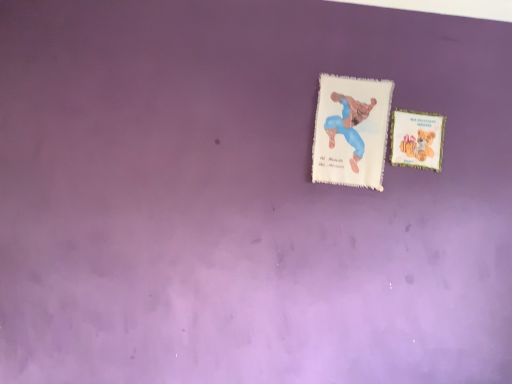
Describe the element at coordinates (351, 131) in the screenshot. I see `white felt card at upper center, placed as the 2th card when sorted from right to left` at that location.

The width and height of the screenshot is (512, 384). Identify the location of white felt card at upper center, arranged as the first card when viewed from the left. (351, 131).

Identify the location of matte paper card at right, which is counted as the 1th card, starting from the right. This screenshot has height=384, width=512. (417, 139).

In order to face matte paper card at right, marked as the 2th card in a left-to-right arrangement, should I rotate leftwards or rightwards?

To face it directly, rotate right by 21.128 degrees.

This screenshot has height=384, width=512. Describe the element at coordinates (417, 139) in the screenshot. I see `matte paper card at right, which is counted as the 1th card, starting from the right` at that location.

Locate an element on the screen. Image resolution: width=512 pixels, height=384 pixels. white felt card at upper center, arranged as the first card when viewed from the left is located at coordinates [351, 131].

In the image, is matte paper card at right, which is counted as the 1th card, starting from the right, on the left side or the right side of white felt card at upper center, arranged as the first card when viewed from the left?

Clearly, matte paper card at right, which is counted as the 1th card, starting from the right, is on the right of white felt card at upper center, arranged as the first card when viewed from the left, in the image.

Is matte paper card at right, which is counted as the 1th card, starting from the right, closer to the viewer compared to white felt card at upper center, arranged as the first card when viewed from the left?

No, the depth of matte paper card at right, which is counted as the 1th card, starting from the right, is greater than that of white felt card at upper center, arranged as the first card when viewed from the left.

Considering the positions of point (405, 142) and point (371, 112), is point (405, 142) closer or farther from the camera than point (371, 112)?

Point (405, 142).

From the image's perspective, is matte paper card at right, marked as the 2th card in a left-to-right arrangement, over white felt card at upper center, arranged as the first card when viewed from the left?

Incorrect, from the image's perspective, matte paper card at right, marked as the 2th card in a left-to-right arrangement, is lower than white felt card at upper center, arranged as the first card when viewed from the left.

From a real-world perspective, is matte paper card at right, which is counted as the 1th card, starting from the right, above or below white felt card at upper center, placed as the 2th card when sorted from right to left?

From a real-world perspective, matte paper card at right, which is counted as the 1th card, starting from the right, is physically above white felt card at upper center, placed as the 2th card when sorted from right to left.

Does matte paper card at right, marked as the 2th card in a left-to-right arrangement, have a greater width compared to white felt card at upper center, placed as the 2th card when sorted from right to left?

No, matte paper card at right, marked as the 2th card in a left-to-right arrangement, is not wider than white felt card at upper center, placed as the 2th card when sorted from right to left.

Which of these two, matte paper card at right, marked as the 2th card in a left-to-right arrangement, or white felt card at upper center, placed as the 2th card when sorted from right to left, stands shorter?

Standing shorter between the two is matte paper card at right, marked as the 2th card in a left-to-right arrangement.

Is matte paper card at right, marked as the 2th card in a left-to-right arrangement, bigger than white felt card at upper center, arranged as the first card when viewed from the left?

No.

Is matte paper card at right, which is counted as the 1th card, starting from the right, spatially inside white felt card at upper center, placed as the 2th card when sorted from right to left, or outside of it?

matte paper card at right, which is counted as the 1th card, starting from the right, is located beyond the bounds of white felt card at upper center, placed as the 2th card when sorted from right to left.

Are matte paper card at right, marked as the 2th card in a left-to-right arrangement, and white felt card at upper center, placed as the 2th card when sorted from right to left, making contact?

No, matte paper card at right, marked as the 2th card in a left-to-right arrangement, is not beside white felt card at upper center, placed as the 2th card when sorted from right to left.

Is matte paper card at right, which is counted as the 1th card, starting from the right, facing away from white felt card at upper center, placed as the 2th card when sorted from right to left?

No, white felt card at upper center, placed as the 2th card when sorted from right to left, is not at the back of matte paper card at right, which is counted as the 1th card, starting from the right.

Measure the distance between matte paper card at right, which is counted as the 1th card, starting from the right, and white felt card at upper center, arranged as the first card when viewed from the left.

matte paper card at right, which is counted as the 1th card, starting from the right, and white felt card at upper center, arranged as the first card when viewed from the left, are 7.91 inches apart.

Locate an element on the screen. The height and width of the screenshot is (384, 512). card located above the matte paper card at right, marked as the 2th card in a left-to-right arrangement (from the image's perspective) is located at coordinates (351, 131).

Visually, is white felt card at upper center, placed as the 2th card when sorted from right to left, positioned to the left or to the right of matte paper card at right, which is counted as the 1th card, starting from the right?

white felt card at upper center, placed as the 2th card when sorted from right to left, is to the left of matte paper card at right, which is counted as the 1th card, starting from the right.

Which object is more forward, white felt card at upper center, placed as the 2th card when sorted from right to left, or matte paper card at right, marked as the 2th card in a left-to-right arrangement?

white felt card at upper center, placed as the 2th card when sorted from right to left, is closer to the camera.

Is point (360, 112) farther from camera compared to point (409, 164)?

Yes, point (360, 112) is behind point (409, 164).

From the image's perspective, between white felt card at upper center, arranged as the first card when viewed from the left, and matte paper card at right, which is counted as the 1th card, starting from the right, who is located below?

matte paper card at right, which is counted as the 1th card, starting from the right, is shown below in the image.

From a real-world perspective, between white felt card at upper center, placed as the 2th card when sorted from right to left, and matte paper card at right, marked as the 2th card in a left-to-right arrangement, who is vertically higher?

In real-world perspective, matte paper card at right, marked as the 2th card in a left-to-right arrangement, is above.

Considering the relative sizes of white felt card at upper center, placed as the 2th card when sorted from right to left, and matte paper card at right, marked as the 2th card in a left-to-right arrangement, in the image provided, is white felt card at upper center, placed as the 2th card when sorted from right to left, wider than matte paper card at right, marked as the 2th card in a left-to-right arrangement,?

Indeed, white felt card at upper center, placed as the 2th card when sorted from right to left, has a greater width compared to matte paper card at right, marked as the 2th card in a left-to-right arrangement.

Who is shorter, white felt card at upper center, arranged as the first card when viewed from the left, or matte paper card at right, marked as the 2th card in a left-to-right arrangement?

matte paper card at right, marked as the 2th card in a left-to-right arrangement, is shorter.

Which of these two, white felt card at upper center, placed as the 2th card when sorted from right to left, or matte paper card at right, which is counted as the 1th card, starting from the right, is smaller?

With smaller size is matte paper card at right, which is counted as the 1th card, starting from the right.

Is matte paper card at right, marked as the 2th card in a left-to-right arrangement, completely or partially inside white felt card at upper center, placed as the 2th card when sorted from right to left?

No, matte paper card at right, marked as the 2th card in a left-to-right arrangement, is not a part of white felt card at upper center, placed as the 2th card when sorted from right to left.

Is there a large distance between white felt card at upper center, placed as the 2th card when sorted from right to left, and matte paper card at right, which is counted as the 1th card, starting from the right?

white felt card at upper center, placed as the 2th card when sorted from right to left, is near matte paper card at right, which is counted as the 1th card, starting from the right, not far away.

Could you tell me if white felt card at upper center, placed as the 2th card when sorted from right to left, is turned towards matte paper card at right, marked as the 2th card in a left-to-right arrangement?

No, white felt card at upper center, placed as the 2th card when sorted from right to left, is not turned towards matte paper card at right, marked as the 2th card in a left-to-right arrangement.

How far apart are white felt card at upper center, arranged as the first card when viewed from the left, and matte paper card at right, which is counted as the 1th card, starting from the right?

The distance of white felt card at upper center, arranged as the first card when viewed from the left, from matte paper card at right, which is counted as the 1th card, starting from the right, is 7.91 inches.

Where is `card above the white felt card at upper center, placed as the 2th card when sorted from right to left (from a real-world perspective)`? This screenshot has width=512, height=384. card above the white felt card at upper center, placed as the 2th card when sorted from right to left (from a real-world perspective) is located at coordinates pos(417,139).

At what (x,y) coordinates should I click in order to perform the action: click on card on the left of the matte paper card at right, marked as the 2th card in a left-to-right arrangement. Please return your answer as a coordinate pair (x, y). This screenshot has width=512, height=384. Looking at the image, I should click on (351, 131).

Locate an element on the screen. This screenshot has height=384, width=512. card behind the white felt card at upper center, arranged as the first card when viewed from the left is located at coordinates (417, 139).